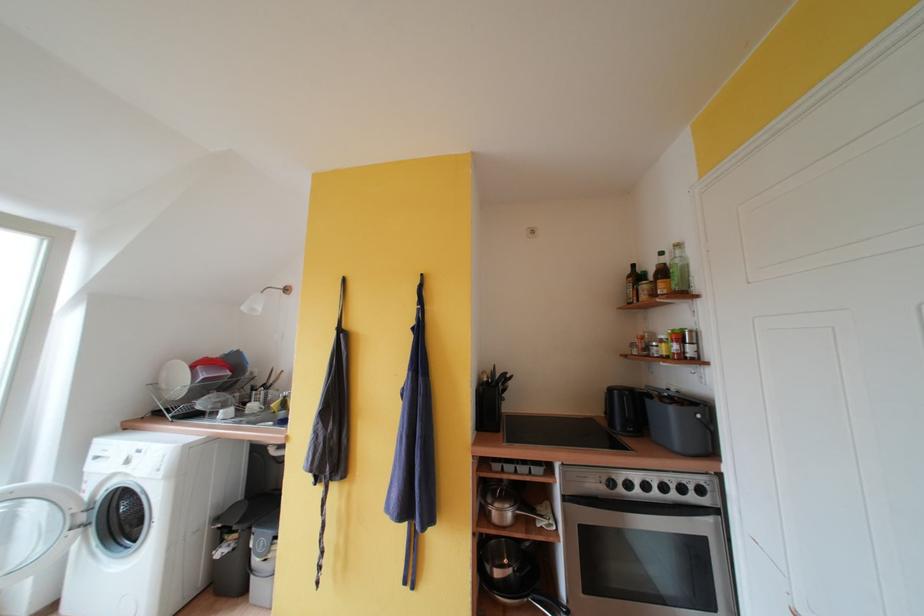
Find the location of a particular element. brown glass bottle is located at coordinates (631, 284).